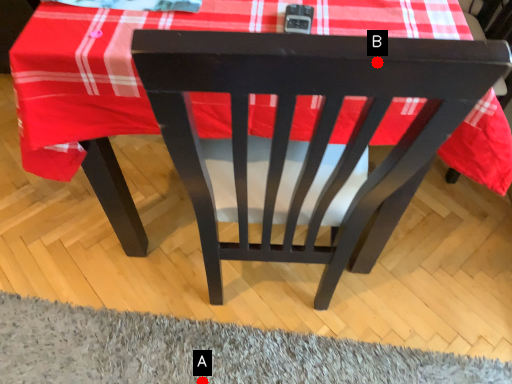
Question: Two points are circled on the image, labeled by A and B beside each circle. Which point appears closest to the camera in this image?

Choices:
 (A) A is closer
 (B) B is closer

Answer: (B)